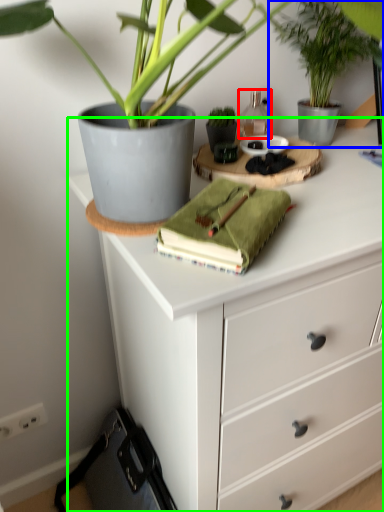
Question: Considering the real-world distances, which object is closest to bottle (highlighted by a red box)? houseplant (highlighted by a blue box) or chest of drawers (highlighted by a green box).

Choices:
 (A) houseplant
 (B) chest of drawers

Answer: (A)